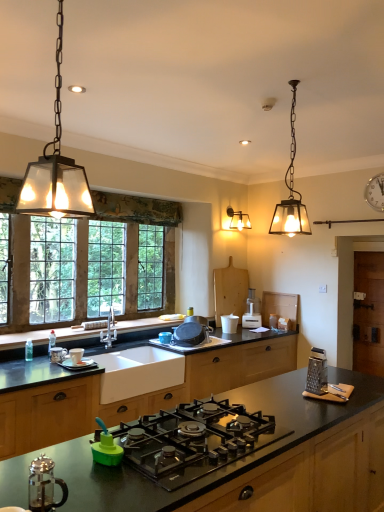
The image size is (384, 512). I want to click on white plastic cup at center, the 4th appliance in the left-to-right sequence, so click(x=229, y=323).

This screenshot has width=384, height=512. What do you see at coordinates (369, 313) in the screenshot? I see `brown wooden door at right, which is counted as the first cabinetry, starting from the back` at bounding box center [369, 313].

Identify the location of brown wooden door at right, which ranks as the second cabinetry in front-to-back order. (369, 313).

Identify the location of matte glass pendant light at upper right, which appears as the 2th lamp when viewed from the left. (291, 192).

Describe the element at coordinates (44, 485) in the screenshot. This screenshot has height=512, width=384. I see `clear glass french press at lower left` at that location.

This screenshot has height=512, width=384. Find the location of `green plastic bottle at lower center, which is the fifth appliance in right-to-left order`. green plastic bottle at lower center, which is the fifth appliance in right-to-left order is located at coordinates (106, 448).

Locate an element on the screen. The width and height of the screenshot is (384, 512). white plastic cup at center, which ranks as the 2th appliance in back-to-front order is located at coordinates (x=229, y=323).

Would you say white plastic cup at center, placed as the 3th appliance when sorted from right to left, contains metallic silver clock at upper right?

Actually, metallic silver clock at upper right is outside white plastic cup at center, placed as the 3th appliance when sorted from right to left.

Find the location of a particular element. Image resolution: width=384 pixels, height=512 pixels. appliance that is the 1st one when counting backward from the metallic silver clock at upper right is located at coordinates (229, 323).

Which is more to the left, white plastic cup at center, which ranks as the 2th appliance in back-to-front order, or metallic silver clock at upper right?

From the viewer's perspective, white plastic cup at center, which ranks as the 2th appliance in back-to-front order, appears more on the left side.

Is white plastic cup at center, which ranks as the 2th appliance in back-to-front order, taller or shorter than metallic silver clock at upper right?

In the image, white plastic cup at center, which ranks as the 2th appliance in back-to-front order, appears to be shorter than metallic silver clock at upper right.

From the image's perspective, which is above, black glass gas stove at center or metallic silver clock at upper right?

From the image's view, metallic silver clock at upper right is above.

Considering the sizes of objects black glass gas stove at center and metallic silver clock at upper right in the image provided, who is wider, black glass gas stove at center or metallic silver clock at upper right?

With larger width is black glass gas stove at center.

Considering the relative sizes of black glass gas stove at center and metallic silver clock at upper right in the image provided, is black glass gas stove at center smaller than metallic silver clock at upper right?

Actually, black glass gas stove at center might be larger than metallic silver clock at upper right.

From a real-world perspective, is black glass gas stove at center physically above metallic silver clock at upper right?

No, from a real-world perspective, black glass gas stove at center is not on top of metallic silver clock at upper right.

Which of these two, shiny black countertop at center or metallic silver clock at upper right, is thinner?

With smaller width is metallic silver clock at upper right.

Does shiny black countertop at center have a smaller size compared to metallic silver clock at upper right?

Incorrect, shiny black countertop at center is not smaller in size than metallic silver clock at upper right.

Does shiny black countertop at center turn towards metallic silver clock at upper right?

No, shiny black countertop at center is not turned towards metallic silver clock at upper right.

Are shiny black countertop at center and metallic silver clock at upper right located far from each other?

shiny black countertop at center is positioned a significant distance from metallic silver clock at upper right.

Which is correct: black glass gas stove at center is inside brown wooden door at right, which is counted as the second cabinetry, starting from the left, or outside of it?

black glass gas stove at center is spatially situated outside brown wooden door at right, which is counted as the second cabinetry, starting from the left.

Which of these two, black glass gas stove at center or brown wooden door at right, which is counted as the second cabinetry, starting from the left, is wider?

Wider between the two is black glass gas stove at center.

Image resolution: width=384 pixels, height=512 pixels. Find the location of `gas stove below the brown wooden door at right, which is counted as the first cabinetry, starting from the back (from the image's perspective)`. gas stove below the brown wooden door at right, which is counted as the first cabinetry, starting from the back (from the image's perspective) is located at coordinates (194, 440).

Who is taller, black glass gas stove at center or brown wooden door at right, which is counted as the second cabinetry, starting from the left?

brown wooden door at right, which is counted as the second cabinetry, starting from the left.

Which of these two, clear glass french press at lower left or matte glass sconce at upper right, is smaller?

With smaller size is clear glass french press at lower left.

Is clear glass french press at lower left looking in the opposite direction of matte glass sconce at upper right?

No.

Which of these two, clear glass french press at lower left or matte glass sconce at upper right, is wider?

With larger width is matte glass sconce at upper right.

Considering the sizes of metallic grater at right, which is counted as the second appliance, starting from the front, and shiny black countertop at center in the image, is metallic grater at right, which is counted as the second appliance, starting from the front, taller or shorter than shiny black countertop at center?

Clearly, metallic grater at right, which is counted as the second appliance, starting from the front, is shorter compared to shiny black countertop at center.

Is metallic grater at right, which is the 5th appliance in back-to-front order, looking in the opposite direction of shiny black countertop at center?

That's not correct — metallic grater at right, which is the 5th appliance in back-to-front order, is not looking away from shiny black countertop at center.

From the image's perspective, is metallic grater at right, which is counted as the second appliance, starting from the front, above or below shiny black countertop at center?

From the image's perspective, metallic grater at right, which is counted as the second appliance, starting from the front, appears above shiny black countertop at center.

Between metallic grater at right, which is the 5th appliance in back-to-front order, and shiny black countertop at center, which one has larger size?

shiny black countertop at center.

Is clear glass french press at lower left directly adjacent to shiny black countertop at center?

No, clear glass french press at lower left is not touching shiny black countertop at center.

From the image's perspective, would you say clear glass french press at lower left is shown under shiny black countertop at center?

Incorrect, from the image's perspective, clear glass french press at lower left is higher than shiny black countertop at center.

Which is behind, point (64, 485) or point (159, 504)?

The point (64, 485) is farther from the camera.

From a real-world perspective, which object rests below the other?

shiny black countertop at center.

What are the coordinates of `clock above the white plastic cup at center, which ranks as the 2th appliance in back-to-front order (from the image's perspective)` in the screenshot? It's located at (375, 192).

Image resolution: width=384 pixels, height=512 pixels. What are the coordinates of `clock above the black glass gas stove at center (from a real-world perspective)` in the screenshot? It's located at (375, 192).

Based on their spatial positions, is green plastic bottle at lower center, which is counted as the 6th appliance, starting from the back, or black glass gas stove at center closer to metallic silver clock at upper right?

The object closer to metallic silver clock at upper right is black glass gas stove at center.

Which object lies further to the anchor point white plastic cup at center, which ranks as the 2th appliance in back-to-front order, matte glass sconce at upper right or black glass gas stove at center?

black glass gas stove at center is further to white plastic cup at center, which ranks as the 2th appliance in back-to-front order.

Which object lies further to the anchor point metallic silver clock at upper right, green plastic bottle at lower center, which is the 2th appliance in left-to-right order, or matte glass pendant light at upper left, which is counted as the second lamp, starting from the back?

The object further to metallic silver clock at upper right is green plastic bottle at lower center, which is the 2th appliance in left-to-right order.

When comparing their distances from green plastic bottle at lower center, which is the 2th appliance in left-to-right order, does shiny black countertop at center or matte black countertop at center, the 2th cabinetry when ordered from back to front, seem further?

matte black countertop at center, the 2th cabinetry when ordered from back to front, is positioned further to the anchor green plastic bottle at lower center, which is the 2th appliance in left-to-right order.

Based on their spatial positions, is white ceramic cup at lower left, which is counted as the fourth appliance, starting from the back, or matte glass pendant light at upper left, which is the first lamp in left-to-right order, further from clear glass french press at lower left?

The object further to clear glass french press at lower left is white ceramic cup at lower left, which is counted as the fourth appliance, starting from the back.

Based on the photo, which object lies further to the anchor point metallic grater at right, which is the 5th appliance in back-to-front order, shiny black countertop at center or white ceramic sink at center?

white ceramic sink at center.

Based on their spatial positions, is matte glass pendant light at upper right, the 1th lamp from the right, or matte black countertop at center, the second cabinetry from the right, further from wooden-framed glass window at left?

Among the two, matte glass pendant light at upper right, the 1th lamp from the right, is located further to wooden-framed glass window at left.

From the picture: From the image, which object appears to be farther from metallic silver clock at upper right, white plastic cup at center, the 4th appliance in the left-to-right sequence, or matte glass sconce at upper right?

Among the two, white plastic cup at center, the 4th appliance in the left-to-right sequence, is located further to metallic silver clock at upper right.

You are a GUI agent. You are given a task and a screenshot of the screen. Output one action in this format:
    pyautogui.click(x=<x>, y=<y>)
    Task: Click on the gas stove between shiny black countertop at center and matte glass sconce at upper right along the z-axis
    Image resolution: width=384 pixels, height=512 pixels.
    Given the screenshot: What is the action you would take?
    pyautogui.click(x=194, y=440)

The image size is (384, 512). I want to click on cabinetry between black glass gas stove at center and black matte pot at center, the fourth appliance viewed from the front, from front to back, so click(x=133, y=393).

Locate an element on the screen. This screenshot has width=384, height=512. sink between matte glass pendant light at upper left, the 2th lamp from the right, and white plastic cup at center, placed as the 3th appliance when sorted from right to left, in the front-back direction is located at coordinates (138, 372).

Where is `cabinetry between black glass gas stove at center and wooden-framed glass window at left along the z-axis`? This screenshot has height=512, width=384. cabinetry between black glass gas stove at center and wooden-framed glass window at left along the z-axis is located at coordinates (133, 393).